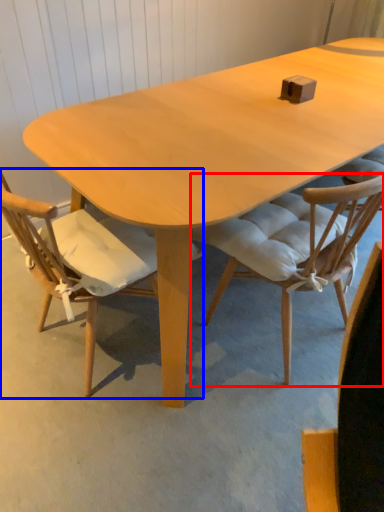
Question: Among these objects, which one is farthest to the camera, chair (highlighted by a red box) or chair (highlighted by a blue box)?

Choices:
 (A) chair
 (B) chair

Answer: (A)